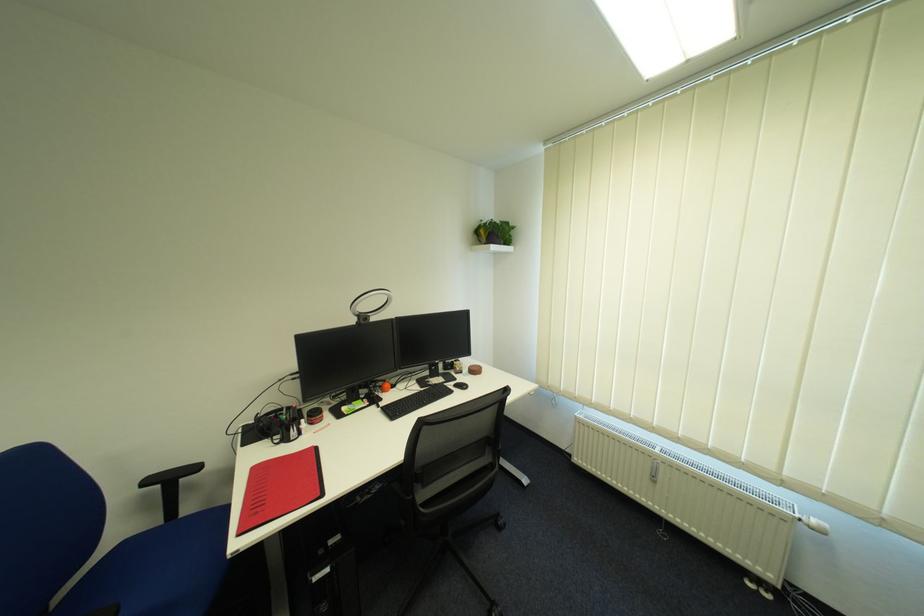
Find where to sit the blue chair sitting surface. Please return your answer as a coordinate pair (x, y).

(156, 570)